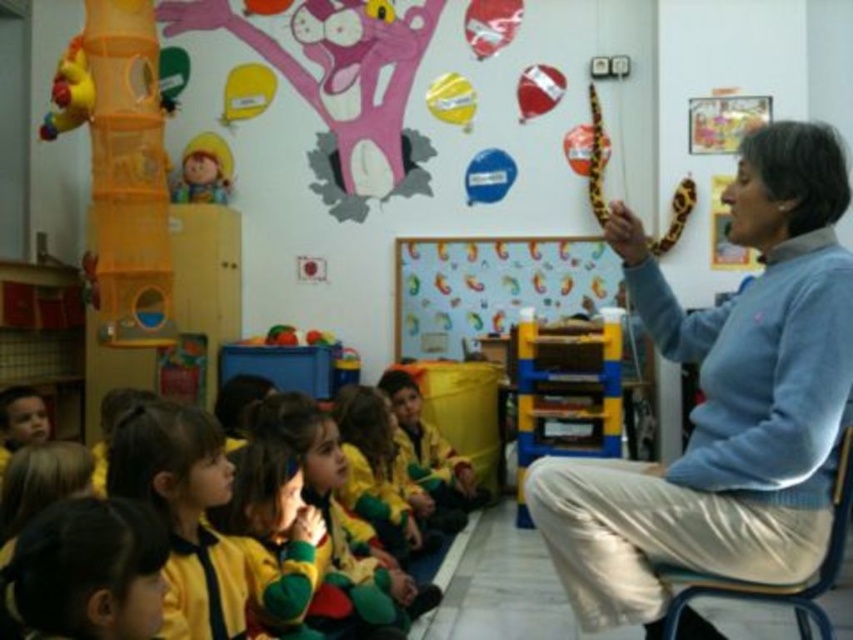
Does point (149, 422) come behind point (218, 157)?

No, (149, 422) is in front of (218, 157).

Can you confirm if yellow-green jersey at lower left is positioned above matte yellow plush toy at upper left?

No, yellow-green jersey at lower left is not above matte yellow plush toy at upper left.

Is point (181, 483) behind point (194, 150)?

No, it is not.

The image size is (853, 640). I want to click on yellow-green jersey at lower left, so click(x=184, y=515).

Can you confirm if yellow fabric uniform at lower left is thinner than white paperboard at center?

Indeed, yellow fabric uniform at lower left has a lesser width compared to white paperboard at center.

Can you confirm if yellow fabric uniform at lower left is positioned to the left of white paperboard at center?

Yes, yellow fabric uniform at lower left is to the left of white paperboard at center.

Where is `yellow fabric uniform at lower left`? The image size is (853, 640). yellow fabric uniform at lower left is located at coordinates (218, 467).

Does yellow fabric uniform at lower left have a greater width compared to orange fabric tunnel at left?

In fact, yellow fabric uniform at lower left might be narrower than orange fabric tunnel at left.

Is point (125, 464) farther from camera compared to point (74, 67)?

No, it is not.

What do you see at coordinates (218, 467) in the screenshot?
I see `yellow fabric uniform at lower left` at bounding box center [218, 467].

This screenshot has height=640, width=853. I want to click on yellow fabric uniform at lower left, so click(218, 467).